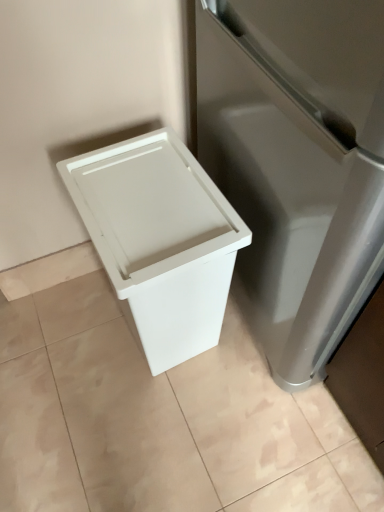
What is the approximate height of white plastic trash can at lower left?

white plastic trash can at lower left is 3.69 centimeters tall.

What do you see at coordinates (160, 420) in the screenshot? This screenshot has height=512, width=384. I see `white plastic trash can at lower left` at bounding box center [160, 420].

Identify the location of white plastic trash can at lower left. (160, 420).

This screenshot has width=384, height=512. Describe the element at coordinates (160, 240) in the screenshot. I see `white plastic waste bin at lower left` at that location.

The image size is (384, 512). Identify the location of white plastic waste bin at lower left. (160, 240).

Locate an element on the screen. The image size is (384, 512). white plastic trash can at lower left is located at coordinates (160, 420).

Considering the positions of objects white plastic trash can at lower left and white plastic waste bin at lower left in the image provided, who is more to the left, white plastic trash can at lower left or white plastic waste bin at lower left?

white plastic trash can at lower left is more to the left.

Relative to white plastic waste bin at lower left, is white plastic trash can at lower left in front or behind?

In the image, white plastic trash can at lower left appears behind white plastic waste bin at lower left.

Does point (366, 505) lie in front of point (218, 196)?

No, (366, 505) is behind (218, 196).

From the image's perspective, is white plastic trash can at lower left on top of white plastic waste bin at lower left?

Actually, white plastic trash can at lower left appears below white plastic waste bin at lower left in the image.

From a real-world perspective, is white plastic trash can at lower left positioned under white plastic waste bin at lower left based on gravity?

Yes, from a real-world perspective, white plastic trash can at lower left is beneath white plastic waste bin at lower left.

Does white plastic trash can at lower left have a greater width compared to white plastic waste bin at lower left?

Yes.

Consider the image. Which of these two, white plastic trash can at lower left or white plastic waste bin at lower left, stands taller?

white plastic waste bin at lower left is taller.

Who is smaller, white plastic trash can at lower left or white plastic waste bin at lower left?

Smaller between the two is white plastic trash can at lower left.

Is white plastic trash can at lower left situated inside white plastic waste bin at lower left or outside?

white plastic trash can at lower left exists outside the volume of white plastic waste bin at lower left.

Looking at this image, is white plastic trash can at lower left next to white plastic waste bin at lower left?

No, white plastic trash can at lower left is not in contact with white plastic waste bin at lower left.

Could you tell me if white plastic trash can at lower left is facing white plastic waste bin at lower left?

No, white plastic trash can at lower left is not aimed at white plastic waste bin at lower left.

You are a GUI agent. You are given a task and a screenshot of the screen. Output one action in this format:
    pyautogui.click(x=<x>, y=<y>)
    Task: Click on the tile that is under the white plastic waste bin at lower left (from a real-world perspective)
    The height and width of the screenshot is (512, 384).
    Given the screenshot: What is the action you would take?
    pyautogui.click(x=160, y=420)

Between white plastic waste bin at lower left and white plastic trash can at lower left, which one appears on the right side from the viewer's perspective?

Positioned to the right is white plastic waste bin at lower left.

Consider the image. Between white plastic waste bin at lower left and white plastic trash can at lower left, which one is positioned behind?

white plastic trash can at lower left.

Which is behind, point (125, 181) or point (55, 361)?

The point (55, 361) is behind.

From the image's perspective, is white plastic waste bin at lower left above or below white plastic trash can at lower left?

Clearly, from the image's perspective, white plastic waste bin at lower left is above white plastic trash can at lower left.

From a real-world perspective, is white plastic waste bin at lower left located beneath white plastic trash can at lower left?

Result: Incorrect, from a real-world perspective, white plastic waste bin at lower left is higher than white plastic trash can at lower left.

Which of these two, white plastic waste bin at lower left or white plastic trash can at lower left, is thinner?

white plastic waste bin at lower left is thinner.

Can you confirm if white plastic waste bin at lower left is shorter than white plastic trash can at lower left?

In fact, white plastic waste bin at lower left may be taller than white plastic trash can at lower left.

In the scene shown: Considering the relative sizes of white plastic waste bin at lower left and white plastic trash can at lower left in the image provided, is white plastic waste bin at lower left smaller than white plastic trash can at lower left?

Actually, white plastic waste bin at lower left might be larger than white plastic trash can at lower left.

Is white plastic waste bin at lower left situated inside white plastic trash can at lower left or outside?

white plastic waste bin at lower left lies outside white plastic trash can at lower left.

Is white plastic waste bin at lower left far from white plastic trash can at lower left?

They are positioned close to each other.

Could you tell me if white plastic waste bin at lower left is facing white plastic trash can at lower left?

No, white plastic waste bin at lower left does not turn towards white plastic trash can at lower left.

Based on the photo, how distant is white plastic waste bin at lower left from white plastic trash can at lower left?

white plastic waste bin at lower left and white plastic trash can at lower left are 14.36 inches apart from each other.

I want to click on waste container above the white plastic trash can at lower left (from a real-world perspective), so pyautogui.click(x=160, y=240).

Image resolution: width=384 pixels, height=512 pixels. Find the location of `tile behind the white plastic waste bin at lower left`. tile behind the white plastic waste bin at lower left is located at coordinates (160, 420).

Where is `waste container above the white plastic trash can at lower left (from the image's perspective)`? waste container above the white plastic trash can at lower left (from the image's perspective) is located at coordinates (160, 240).